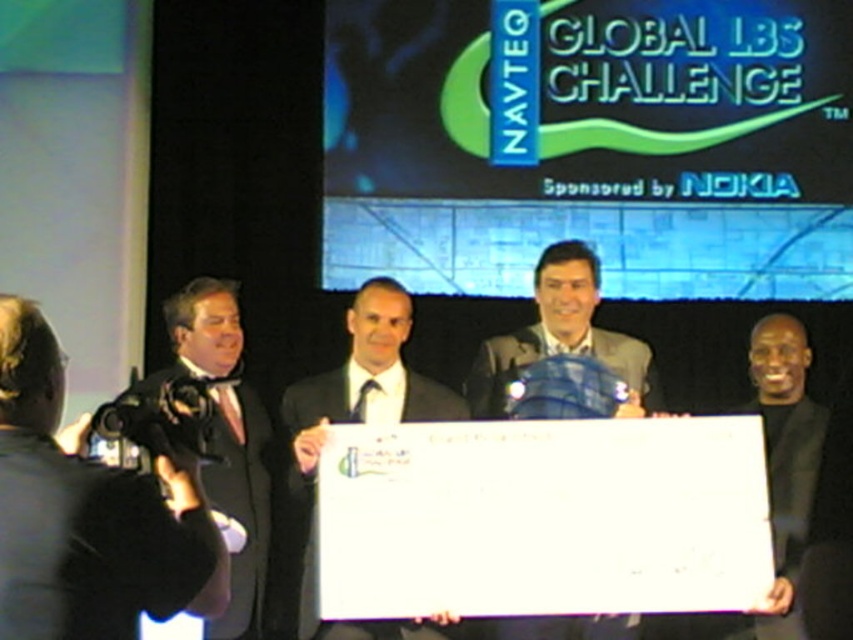
This screenshot has width=853, height=640. What are the coordinates of `black glossy camera at left` in the screenshot? It's located at (88, 513).

Is black glossy camera at left taller than gray fabric suit at center?

No, black glossy camera at left is not taller than gray fabric suit at center.

Where is `black glossy camera at left`? This screenshot has width=853, height=640. black glossy camera at left is located at coordinates (88, 513).

Image resolution: width=853 pixels, height=640 pixels. Describe the element at coordinates (241, 506) in the screenshot. I see `black satin suit at left` at that location.

Is black satin suit at left above gray fabric suit at center?

Actually, black satin suit at left is below gray fabric suit at center.

Locate an element on the screen. Image resolution: width=853 pixels, height=640 pixels. black satin suit at left is located at coordinates (241, 506).

Does black glossy camera at left come behind black satin suit at left?

No, black glossy camera at left is in front of black satin suit at left.

Does point (45, 456) lie in front of point (198, 292)?

Yes, point (45, 456) is closer to viewer.

The height and width of the screenshot is (640, 853). What are the coordinates of `black glossy camera at left` in the screenshot? It's located at coord(88,513).